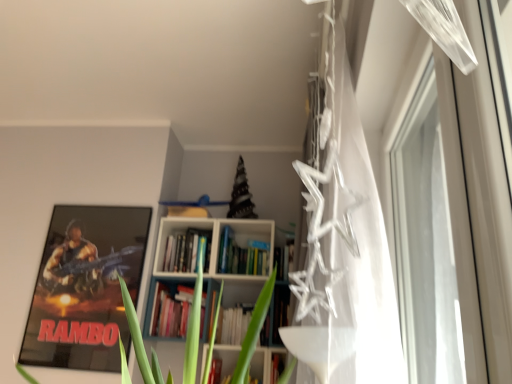
Question: Does hardcover books at center come in front of transparent glass window at upper right?

Choices:
 (A) no
 (B) yes

Answer: (A)

Question: Is hardcover books at center outside transparent glass window at upper right?

Choices:
 (A) no
 (B) yes

Answer: (B)

Question: Is transparent glass window at upper right inside hardcover books at center?

Choices:
 (A) no
 (B) yes

Answer: (A)

Question: Can you confirm if hardcover books at center is thinner than transparent glass window at upper right?

Choices:
 (A) no
 (B) yes

Answer: (A)

Question: Is hardcover books at center at the right side of transparent glass window at upper right?

Choices:
 (A) yes
 (B) no

Answer: (B)

Question: Is hardcover books at center behind transparent glass window at upper right?

Choices:
 (A) yes
 (B) no

Answer: (A)

Question: Is hardcover books at center oriented away from metallic rambo poster at left?

Choices:
 (A) no
 (B) yes

Answer: (A)

Question: Is hardcover books at center at the right side of metallic rambo poster at left?

Choices:
 (A) no
 (B) yes

Answer: (B)

Question: Is hardcover books at center smaller than metallic rambo poster at left?

Choices:
 (A) no
 (B) yes

Answer: (B)

Question: Does hardcover books at center have a greater height compared to metallic rambo poster at left?

Choices:
 (A) no
 (B) yes

Answer: (A)

Question: From a real-world perspective, is hardcover books at center located beneath metallic rambo poster at left?

Choices:
 (A) no
 (B) yes

Answer: (A)

Question: From a real-world perspective, is hardcover books at center over metallic rambo poster at left?

Choices:
 (A) yes
 (B) no

Answer: (A)

Question: Does transparent plastic stars at upper right have a greater height compared to metallic rambo poster at left?

Choices:
 (A) no
 (B) yes

Answer: (B)